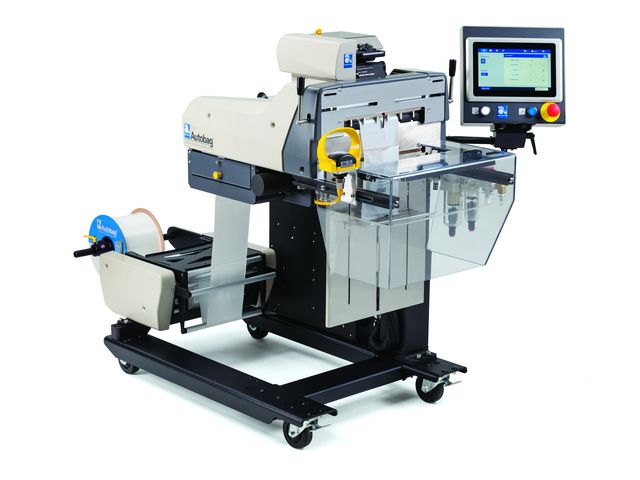
Locate an element on the screen. This screenshot has height=480, width=640. computer is located at coordinates (365, 56).